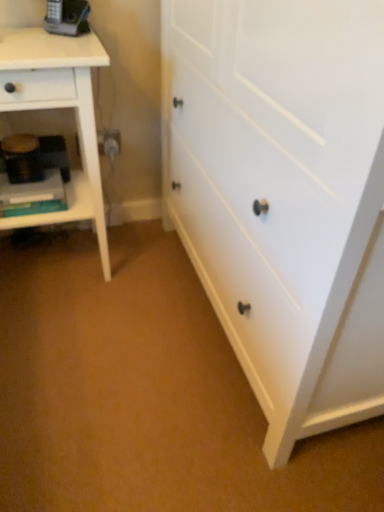
What are the coordinates of `free point below white wood nightstand at left (from a real-world perspective)` in the screenshot? It's located at (56, 263).